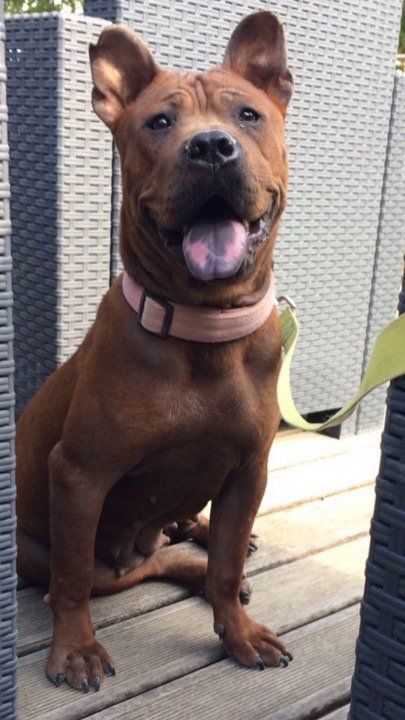
Where is `wood floor`? The height and width of the screenshot is (720, 405). wood floor is located at coordinates (206, 512), (334, 648).